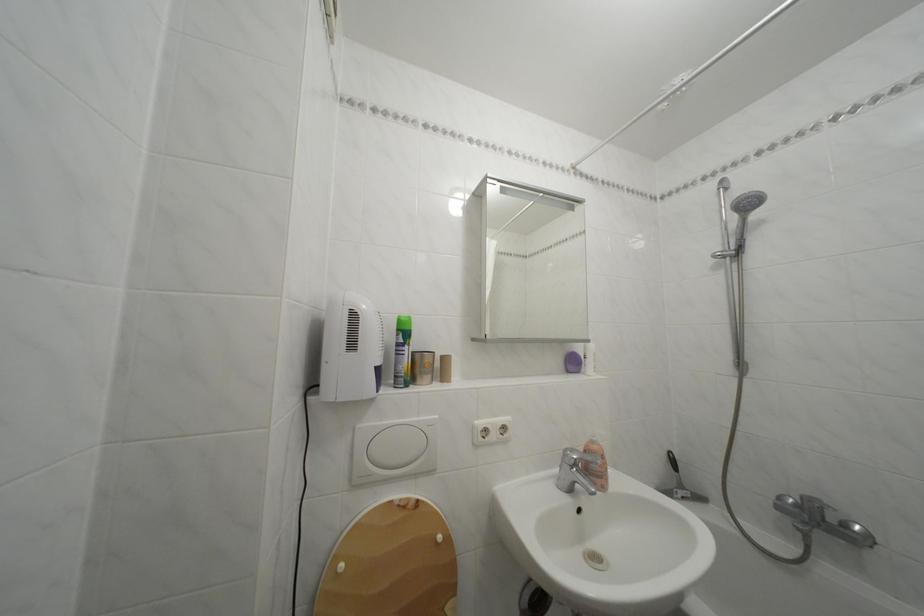
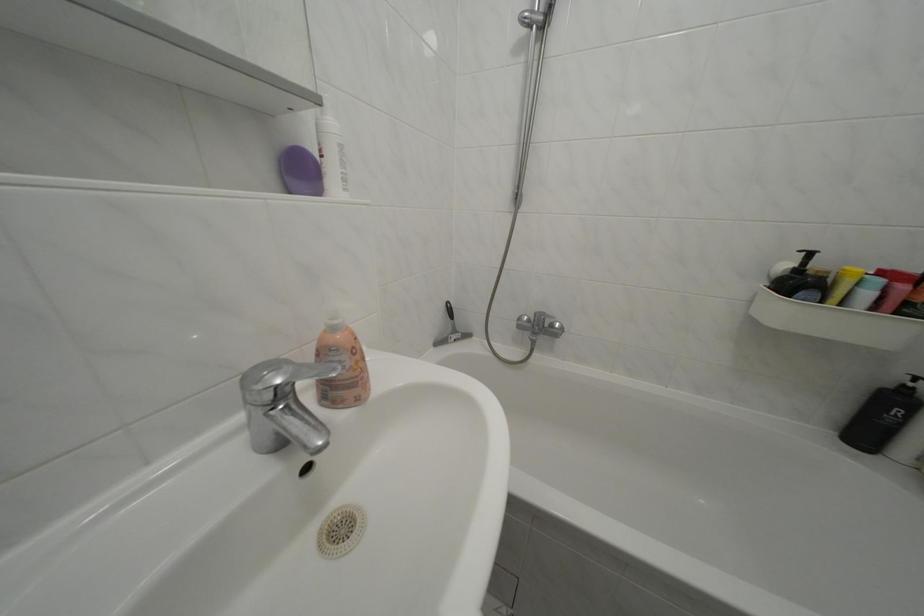
The first image is from the beginning of the video and the second image is from the end. How did the camera likely rotate when shooting the video?

The camera rotated toward right-down.